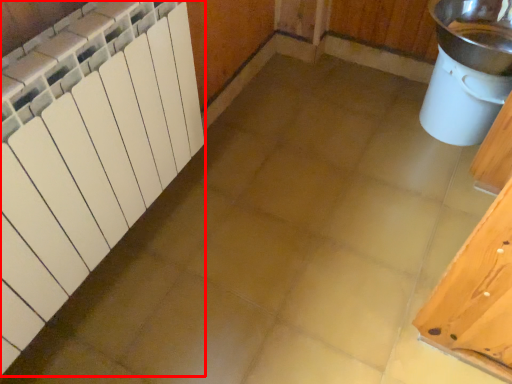
Question: Observing the image, what is the correct spatial positioning of radiator (annotated by the red box) in reference to sink?

Choices:
 (A) left
 (B) right

Answer: (A)